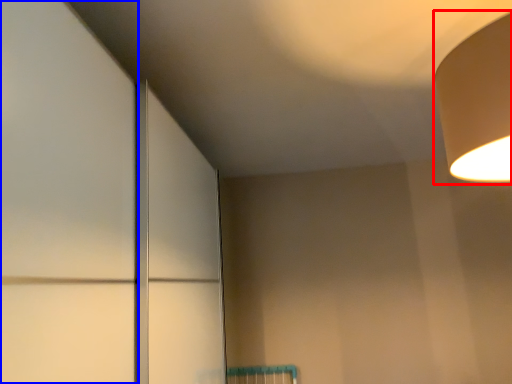
Question: Which point is closer to the camera, lamp (highlighted by a red box) or door (highlighted by a blue box)?

Choices:
 (A) lamp
 (B) door

Answer: (B)